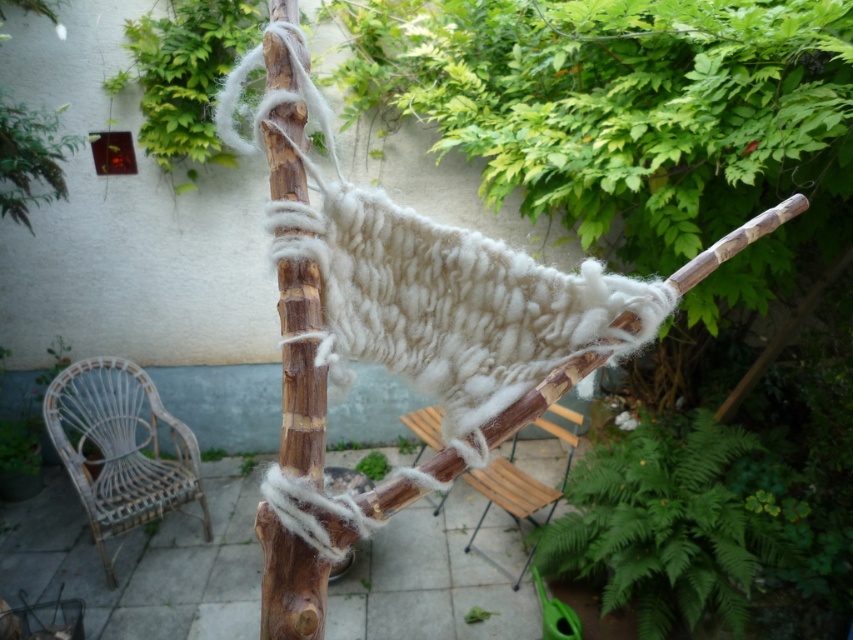
Looking at this image, you are standing in front of the handmade hammock and notice two points marked on the structure. Which point, point (296, 177) or point (495, 476), is closer to you?

Point (296, 177) is closer to the camera than point (495, 476), so it is closer to you.

You are a painter standing in the garden and want to place a wooden stick at center next to the white wicker chair at lower left. Which object is shorter so you can decide where to put it?

The wooden stick at center is not as tall as the white wicker chair at lower left, so the wooden stick at center is shorter and can be placed next to it.

You are trying to hang a 2.5 meters long wooden stick between the two wooden poles supporting the hammock. Can the wooden stick at center and wooden at center support the stick without it touching the ground?

The wooden stick at center and wooden at center are 2.58 meters apart from each other. Since the wooden stick to be hung is 2.5 meters long, it will fit between them without touching the ground as the distance between the poles is slightly larger than the stick.